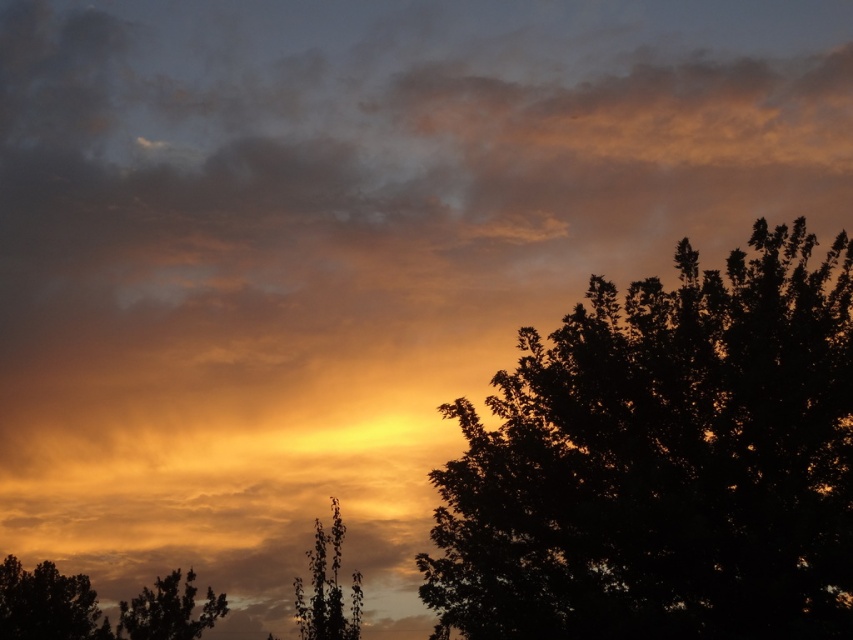
Question: Can you confirm if silhouette leafy tree at right is positioned above black matte tree at lower left?

Choices:
 (A) no
 (B) yes

Answer: (B)

Question: Which point appears farthest from the camera in this image?

Choices:
 (A) (39, 589)
 (B) (173, 614)
 (C) (317, 630)
 (D) (833, 440)

Answer: (A)

Question: Can you confirm if black matte tree at lower left is bigger than green leafy tree at center?

Choices:
 (A) yes
 (B) no

Answer: (B)

Question: Is black matte tree at lower left in front of green leafy tree at center?

Choices:
 (A) no
 (B) yes

Answer: (A)

Question: Among these points, which one is nearest to the camera?

Choices:
 (A) (300, 582)
 (B) (35, 566)
 (C) (480, 547)

Answer: (C)

Question: Which is farther from the black matte tree at lower left?

Choices:
 (A) silhouette leafy tree at right
 (B) green leafy tree at center

Answer: (A)